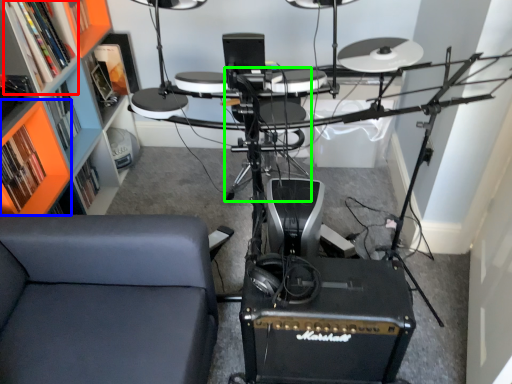
Question: Based on their relative distances, which object is nearer to shelf (highlighted by a red box)? Choose from shelf (highlighted by a blue box) and armchair (highlighted by a green box).

Choices:
 (A) shelf
 (B) armchair

Answer: (A)